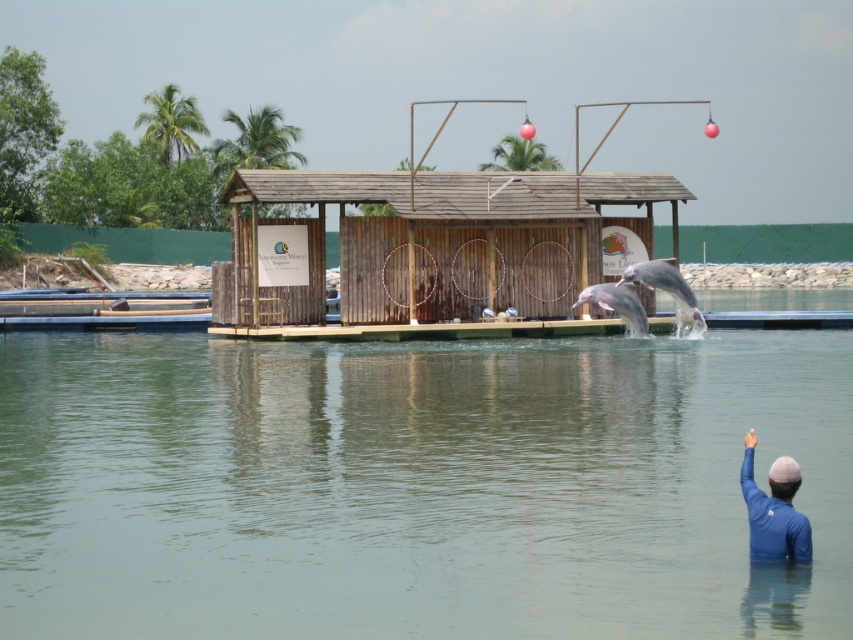
Question: Which object is farther from the camera taking this photo?

Choices:
 (A) blue fabric arm at lower right
 (B) pink smooth dolphin at center
 (C) clear water at center

Answer: (B)

Question: In this image, where is clear water at center located relative to pink smooth dolphin at center?

Choices:
 (A) above
 (B) below

Answer: (B)

Question: Among these objects, which one is nearest to the camera?

Choices:
 (A) blue fabric arm at lower right
 (B) light gray smooth dolphin at center

Answer: (A)

Question: Can you confirm if pink smooth dolphin at center is positioned below light gray smooth dolphin at center?

Choices:
 (A) no
 (B) yes

Answer: (B)

Question: Which object is farther from the camera taking this photo?

Choices:
 (A) pink smooth dolphin at center
 (B) blue fabric arm at lower right
 (C) light gray smooth dolphin at center

Answer: (A)

Question: In this image, where is clear water at center located relative to blue fabric arm at lower right?

Choices:
 (A) below
 (B) above

Answer: (B)